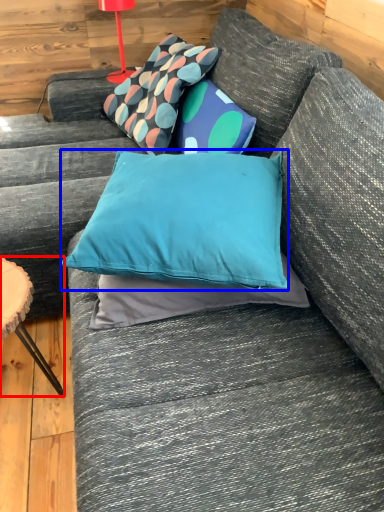
Question: Which point is closer to the camera, furniture (highlighted by a red box) or pillow (highlighted by a blue box)?

Choices:
 (A) furniture
 (B) pillow

Answer: (B)